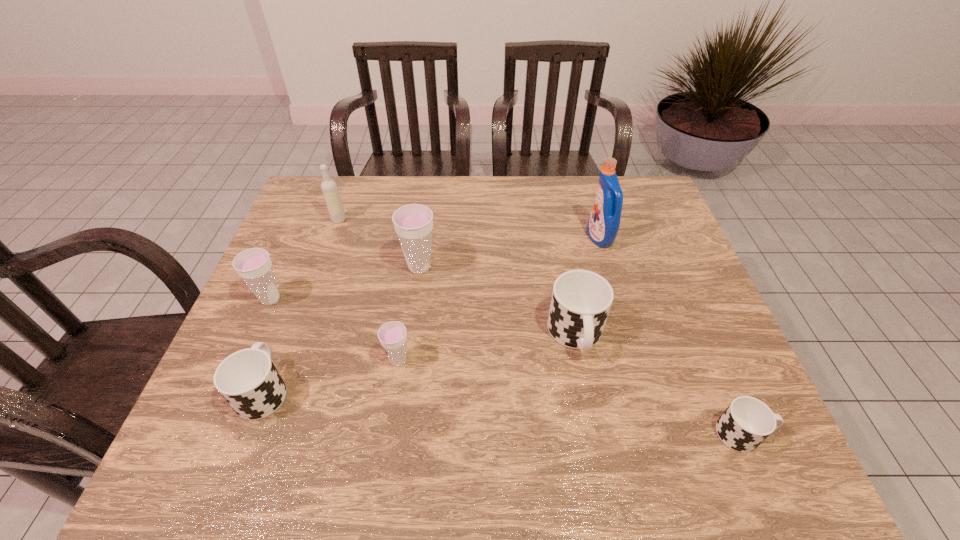
You are a GUI agent. You are given a task and a screenshot of the screen. Output one action in this format:
    pyautogui.click(x=<x>, y=<y>)
    Task: Click on the purple cup that stands as the closest to the seventh object from left to right
    The height and width of the screenshot is (540, 960).
    Given the screenshot: What is the action you would take?
    pyautogui.click(x=413, y=223)

Identify which purple cup is the second closest to the sixth object from left to right. Please provide its 2D coordinates. Your answer should be formatted as a tuple, i.e. [(x, y)], where the tuple contains the x and y coordinates of a point satisfying the conditions above.

[(392, 335)]

Locate an element on the screen. The width and height of the screenshot is (960, 540). black cup that is the second closest to the nearest purple cup is located at coordinates (581, 300).

Image resolution: width=960 pixels, height=540 pixels. Find the location of `the second closest black cup to the fifth cup from left to right`. the second closest black cup to the fifth cup from left to right is located at coordinates [248, 380].

At what (x,y) coordinates should I click in order to perform the action: click on free space that satisfies the following two spatial constraints: 1. on the label of the detergent; 2. on the side of the biggest black cup with the handle. Please return your answer as a coordinate pair (x, y). The image size is (960, 540). Looking at the image, I should click on (628, 335).

This screenshot has width=960, height=540. Identify the location of vacant space that satisfies the following two spatial constraints: 1. on the side of the second biggest black cup with the handle; 2. on the left side of the vodka. (328, 220).

Locate an element on the screen. vacant area in the image that satisfies the following two spatial constraints: 1. on the side of the smallest purple cup with the handle; 2. on the right side of the leftmost black cup is located at coordinates (276, 361).

Find the location of a particular element. The width and height of the screenshot is (960, 540). free space that satisfies the following two spatial constraints: 1. on the front side of the smallest purple cup; 2. on the left side of the vodka is located at coordinates (289, 361).

Where is `free space that satisfies the following two spatial constraints: 1. on the label of the second object from right to left; 2. on the side of the second black cup from right to left with the handle`? free space that satisfies the following two spatial constraints: 1. on the label of the second object from right to left; 2. on the side of the second black cup from right to left with the handle is located at coordinates pyautogui.click(x=628, y=335).